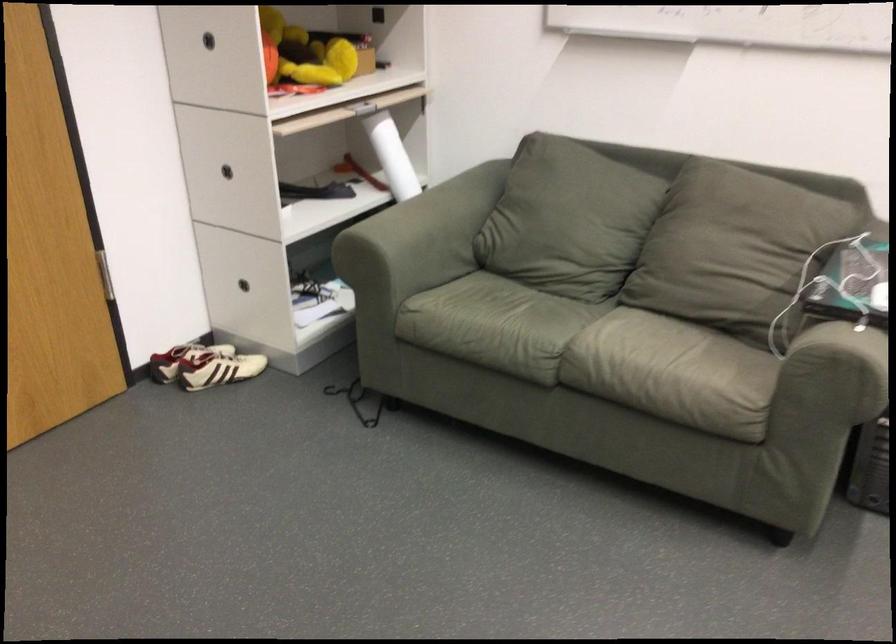
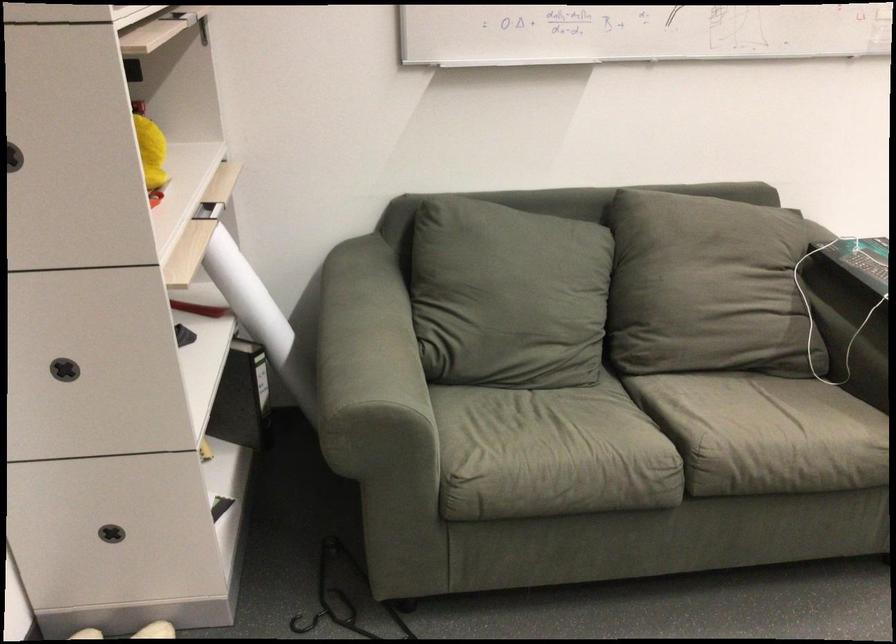
The point at (402, 211) is marked in the first image. Where is the corresponding point in the second image?

(358, 342)